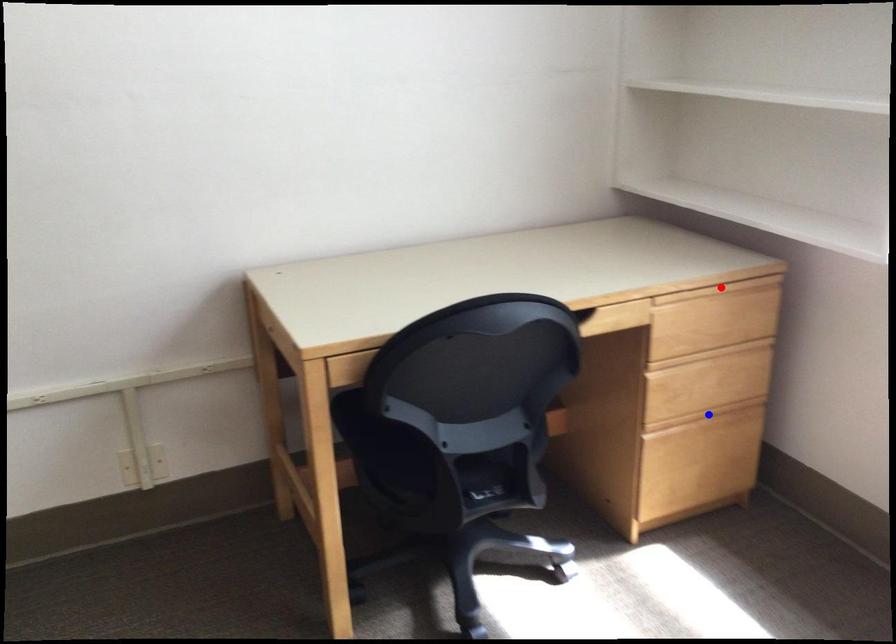
Question: Which of the two points in the image is closer to the camera?

Choices:
 (A) Blue point is closer.
 (B) Red point is closer.

Answer: (B)